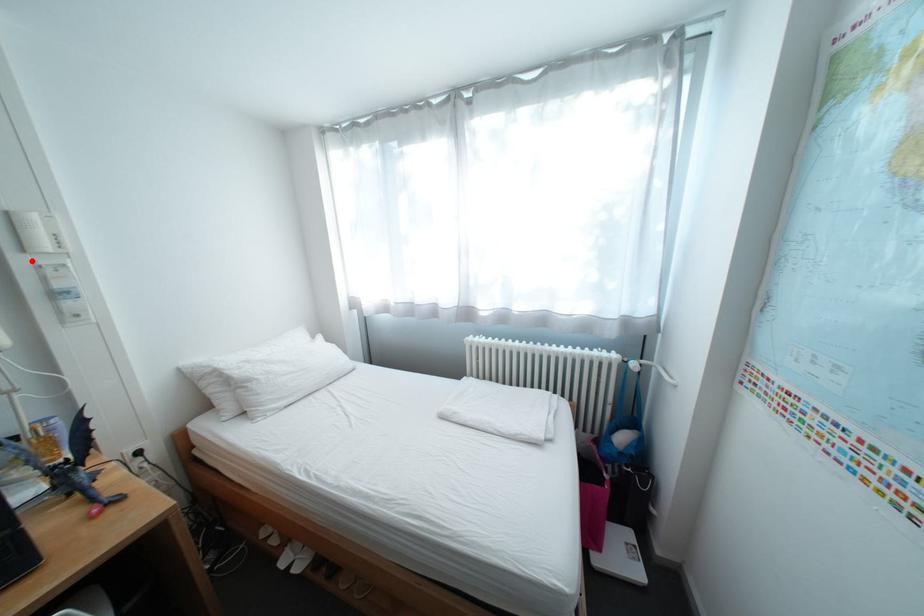
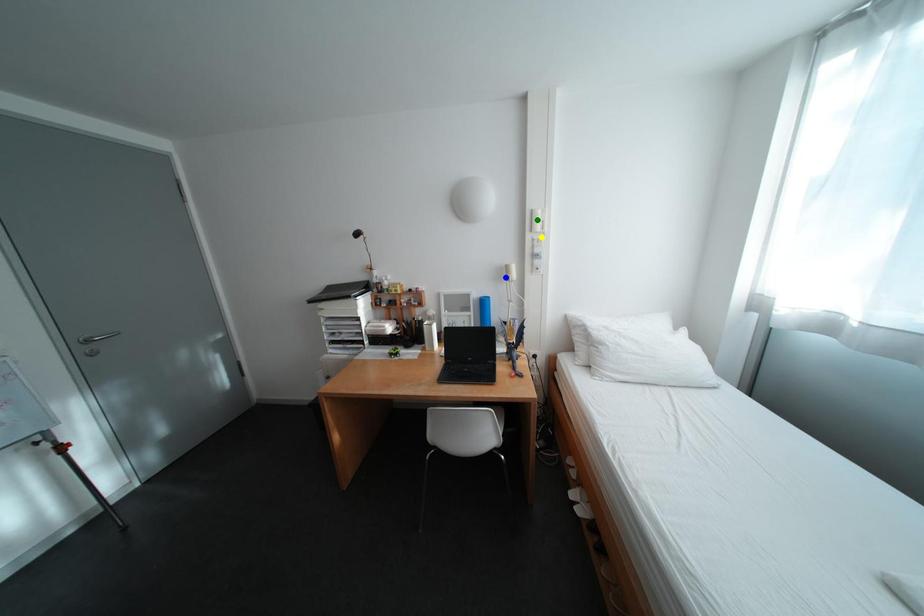
Question: I am providing you with two images of the same scene from different viewpoints. A red point is marked on the first image. You are given multiple points on the second image. Which spot in image 2 lines up with the point in image 1?

Choices:
 (A) blue point
 (B) green point
 (C) yellow point

Answer: (C)